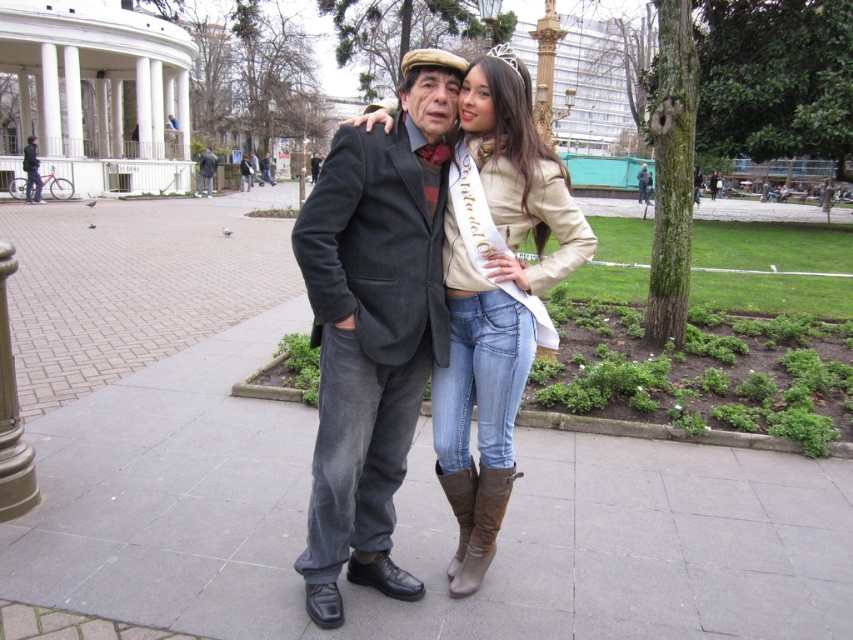
Question: From the image, what is the correct spatial relationship of brushed metal bicycle at left in relation to dark gray suit at center?

Choices:
 (A) below
 (B) above

Answer: (A)

Question: Is leather boots at center closer to camera compared to brown suede boot at lower center?

Choices:
 (A) yes
 (B) no

Answer: (A)

Question: Which point is farther from the camera taking this photo?

Choices:
 (A) (428, 285)
 (B) (483, 573)
 (C) (27, 202)
 (D) (479, 410)

Answer: (C)

Question: Which object is farther from the camera taking this photo?

Choices:
 (A) dark gray suit at center
 (B) brown suede boot at lower center

Answer: (A)

Question: Does dark gray wool suit at center have a smaller size compared to brown suede boot at lower right?

Choices:
 (A) no
 (B) yes

Answer: (A)

Question: Which of the following is the farthest from the observer?

Choices:
 (A) dark gray wool suit at center
 (B) dark gray suit at center

Answer: (B)